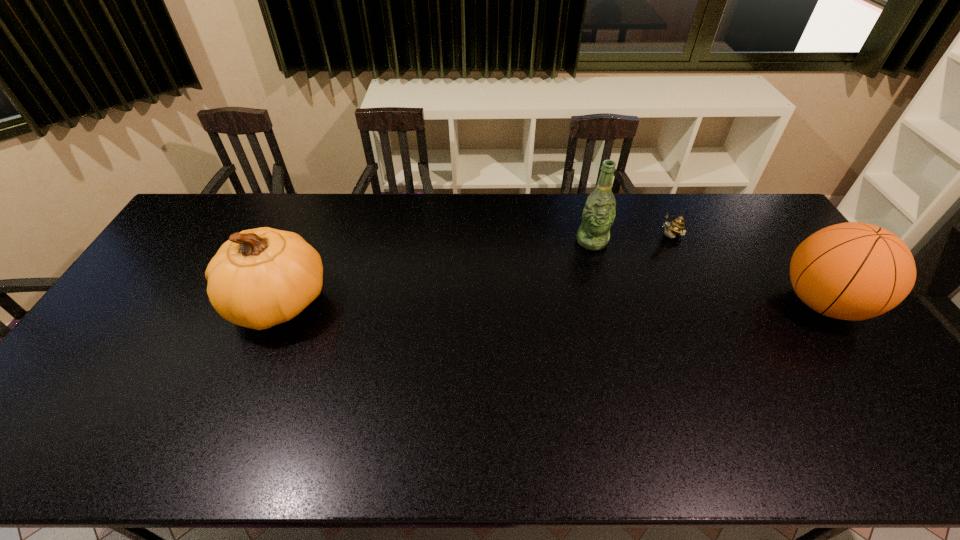
Where is `vacant space that's between the second object from left to right and the leftmost object`? The image size is (960, 540). vacant space that's between the second object from left to right and the leftmost object is located at coordinates (436, 272).

Find the location of a particular element. free space between the leftmost object and the third object from left to right is located at coordinates (474, 270).

Locate an element on the screen. The image size is (960, 540). object that is the closest to the third object from left to right is located at coordinates (598, 215).

Select which object is the third closest to the basketball. Please provide its 2D coordinates. Your answer should be formatted as a tuple, i.e. [(x, y)], where the tuple contains the x and y coordinates of a point satisfying the conditions above.

[(259, 278)]

Find the location of a particular element. vacant area that satisfies the following two spatial constraints: 1. on the front side of the basketball; 2. on the left side of the snail is located at coordinates (699, 303).

I want to click on free region that satisfies the following two spatial constraints: 1. on the front side of the third object from right to left; 2. on the right side of the basketball, so (x=609, y=303).

You are a GUI agent. You are given a task and a screenshot of the screen. Output one action in this format:
    pyautogui.click(x=<x>, y=<y>)
    Task: Click on the free location that satisfies the following two spatial constraints: 1. on the front side of the second object from right to left; 2. on the left side of the basketball
    
    Given the screenshot: What is the action you would take?
    pyautogui.click(x=699, y=303)

Find the location of a particular element. This screenshot has height=540, width=960. free region that satisfies the following two spatial constraints: 1. on the back side of the third object from left to right; 2. on the left side of the beer bottle is located at coordinates (590, 237).